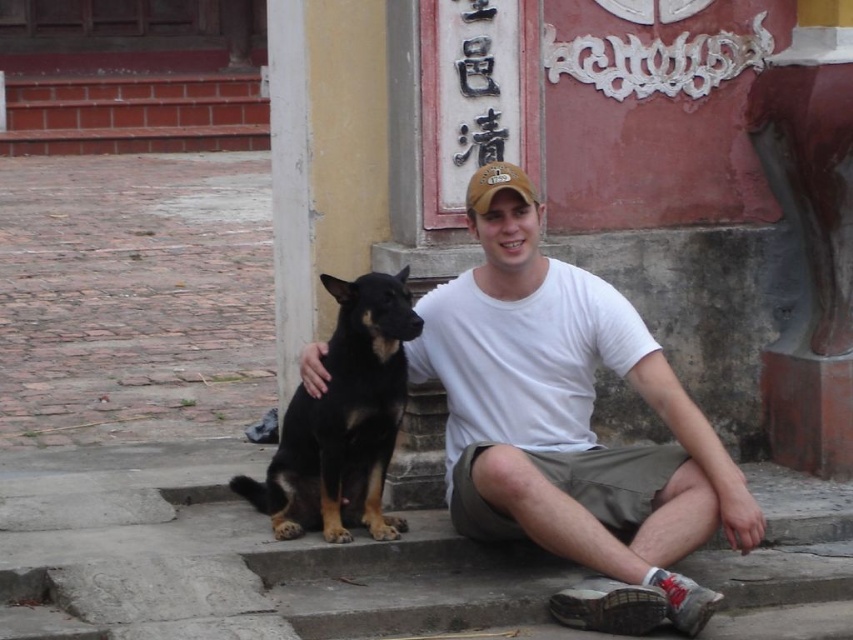
Is point (386, 330) farther from viewer compared to point (485, 195)?

No, (386, 330) is in front of (485, 195).

Is point (393, 381) more distant than point (477, 195)?

Yes, it is behind point (477, 195).

Where is `black fur dog at center`? This screenshot has width=853, height=640. black fur dog at center is located at coordinates tap(343, 420).

Can you confirm if gray concrete stairs at lower center is positioned to the right of brown fabric cap at center?

No, gray concrete stairs at lower center is not to the right of brown fabric cap at center.

Between gray concrete stairs at lower center and brown fabric cap at center, which one is positioned higher?

brown fabric cap at center is above.

In order to click on gray concrete stairs at lower center in this screenshot , I will do `click(231, 557)`.

Can you confirm if gray concrete stairs at lower center is positioned to the left of white cotton t-shirt at center?

Indeed, gray concrete stairs at lower center is positioned on the left side of white cotton t-shirt at center.

Does gray concrete stairs at lower center appear under white cotton t-shirt at center?

Yes.

The height and width of the screenshot is (640, 853). Identify the location of gray concrete stairs at lower center. (231, 557).